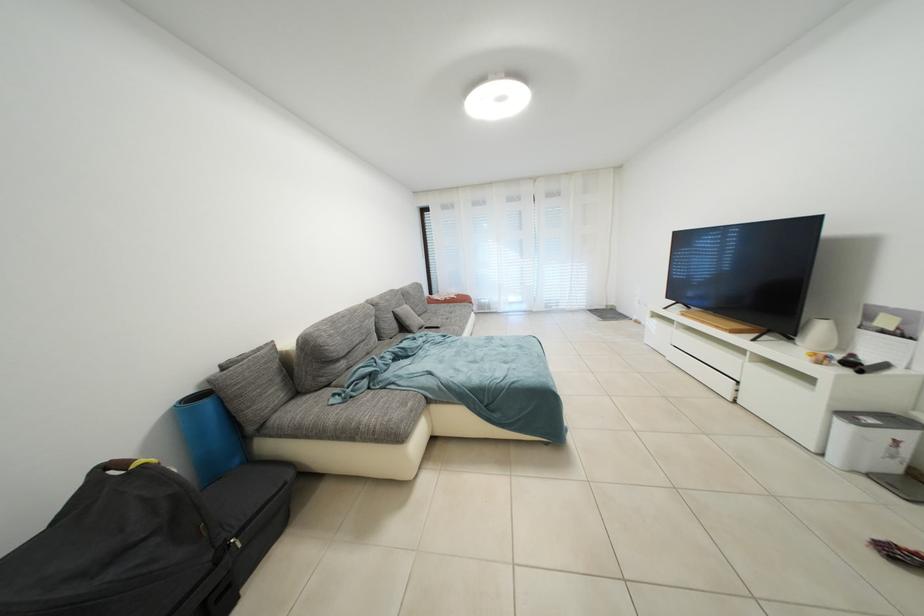
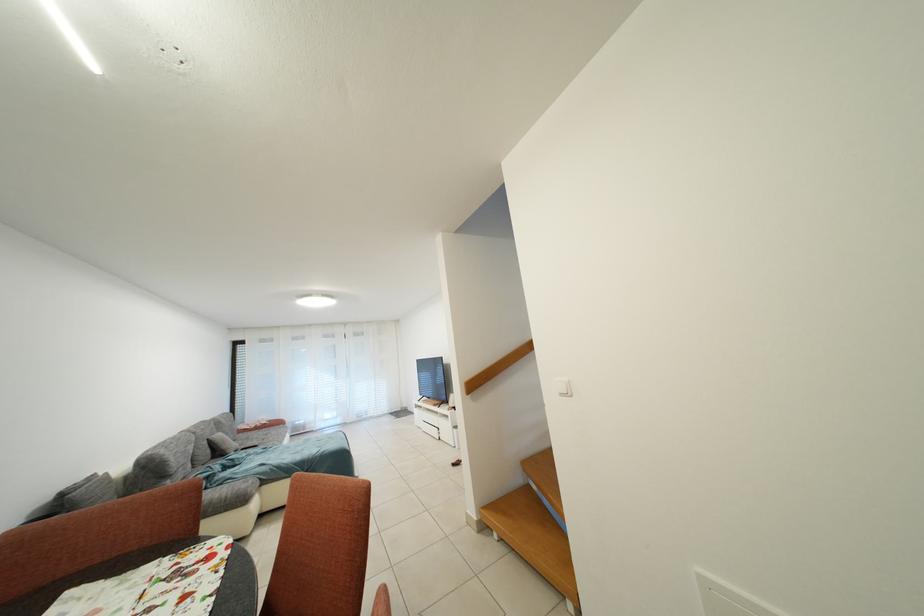
In the second image, find the point that corresponds to (664,320) in the first image.

(426, 410)